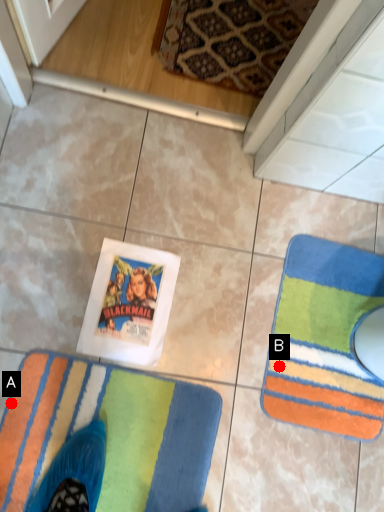
Question: Two points are circled on the image, labeled by A and B beside each circle. Which of the following is the closest to the observer?

Choices:
 (A) A is closer
 (B) B is closer

Answer: (A)